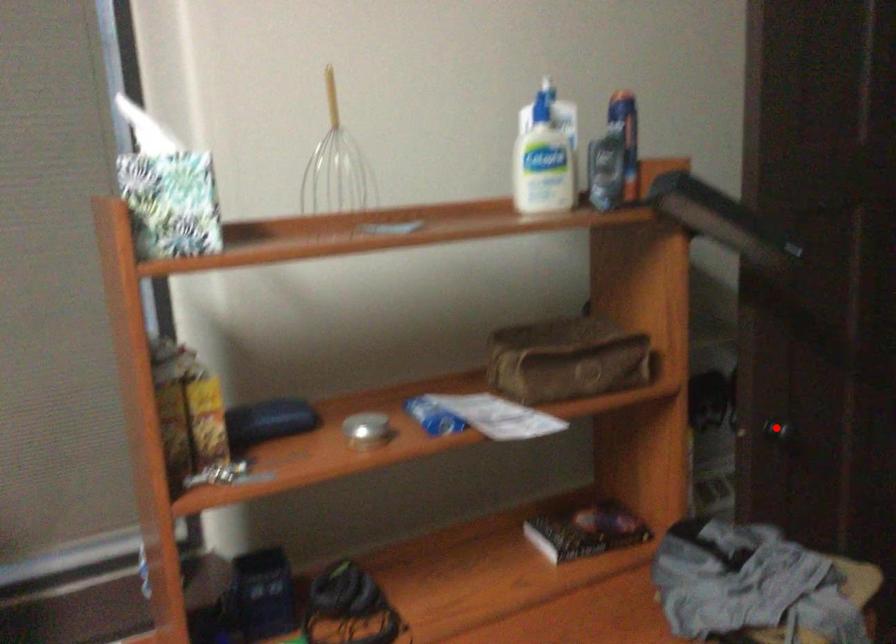
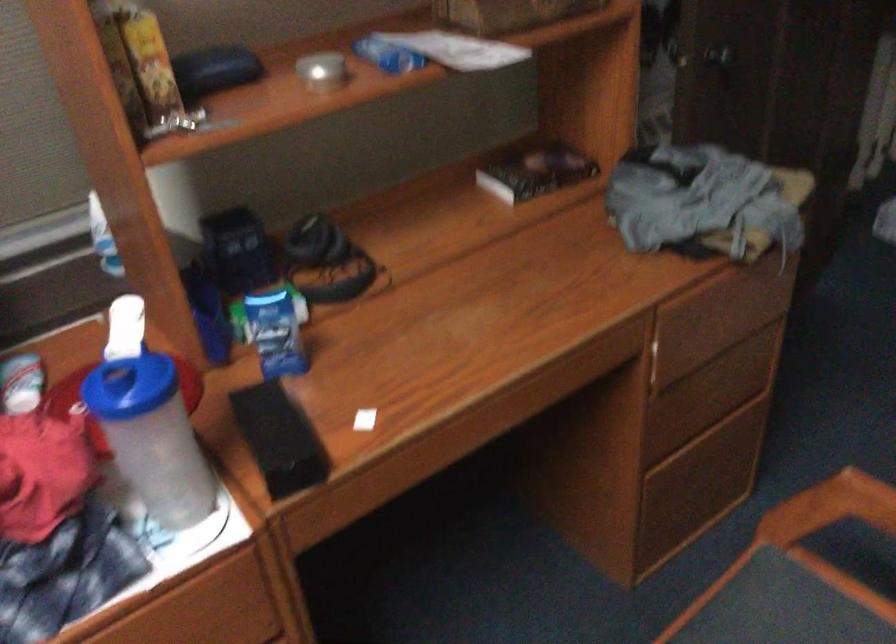
Locate, in the second image, the point that corresponds to the highlighted location in the first image.

(718, 55)